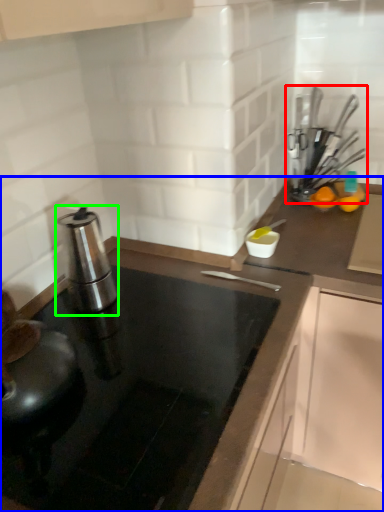
Question: Based on their relative distances, which object is nearer to kitchen appliance (highlighted by a red box)? Choose from countertop (highlighted by a blue box) and kitchen appliance (highlighted by a green box).

Choices:
 (A) countertop
 (B) kitchen appliance

Answer: (A)